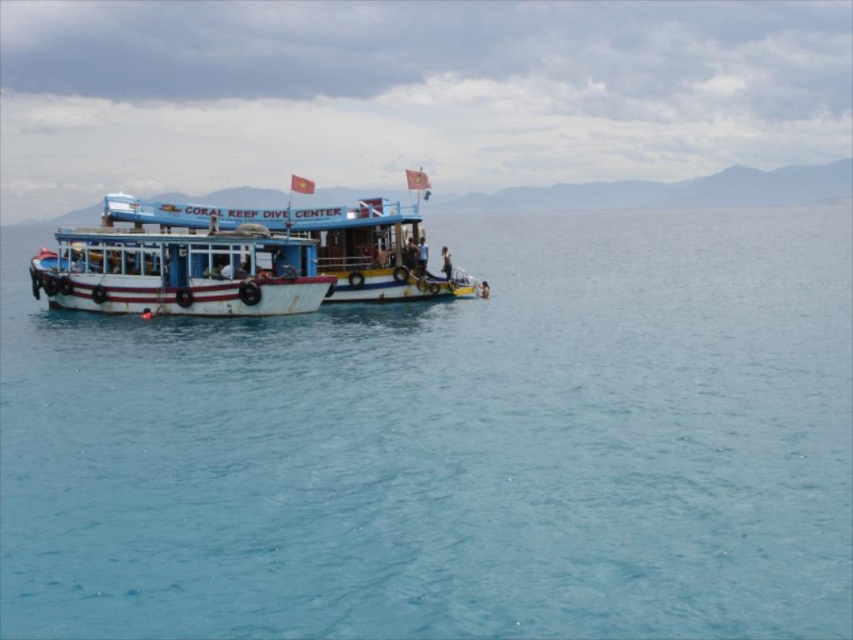
You are a passenger on the white matte boat at center and want to get to the blue water at center. Which direction should you move in?

The blue water at center is to the right of the white matte boat at center, so you should move to the right to reach the blue water at center.

Looking at this image, you are a marine biologist planning to measure the surface area of the blue water at center and the white matte boat at center in the image. Which object has a larger surface area in the image?

The blue water at center has a larger size compared to the white matte boat at center, so the blue water at center has a larger surface area.